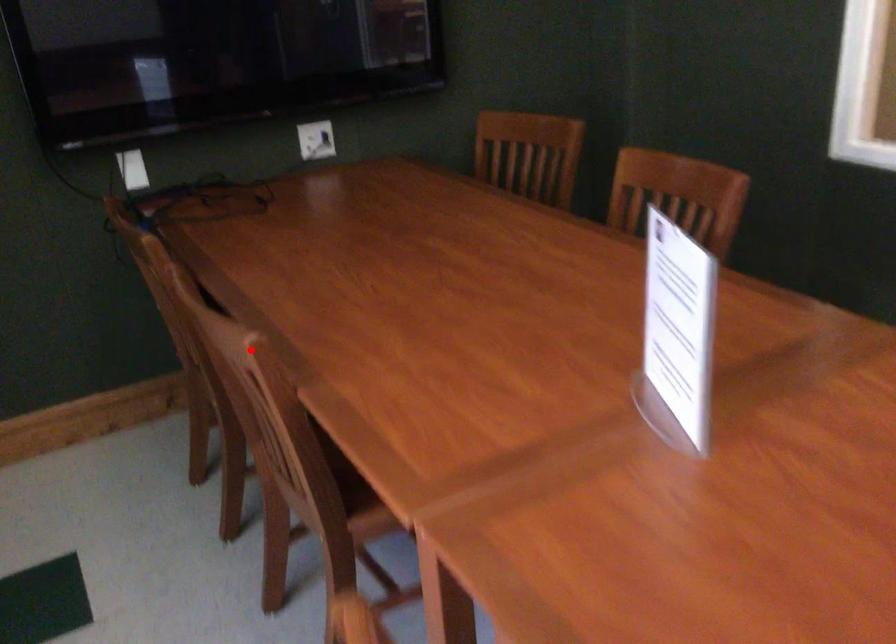
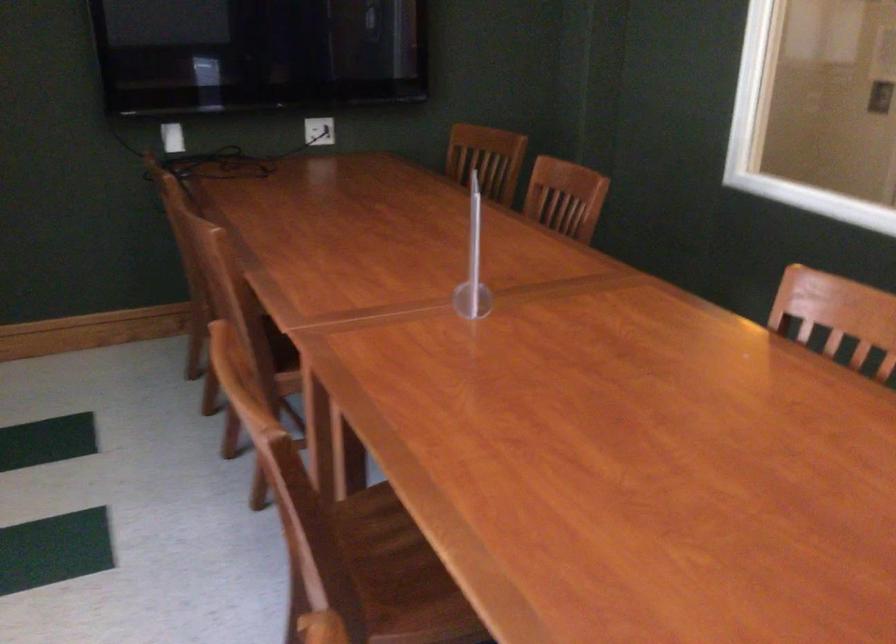
Question: I am providing you with two images of the same scene from different viewpoints. Image1 has a red point marked. In image2, the corresponding 3D location appears at what relative position? Reply with the corresponding letter.

Choices:
 (A) Closer
 (B) Farther

Answer: (B)